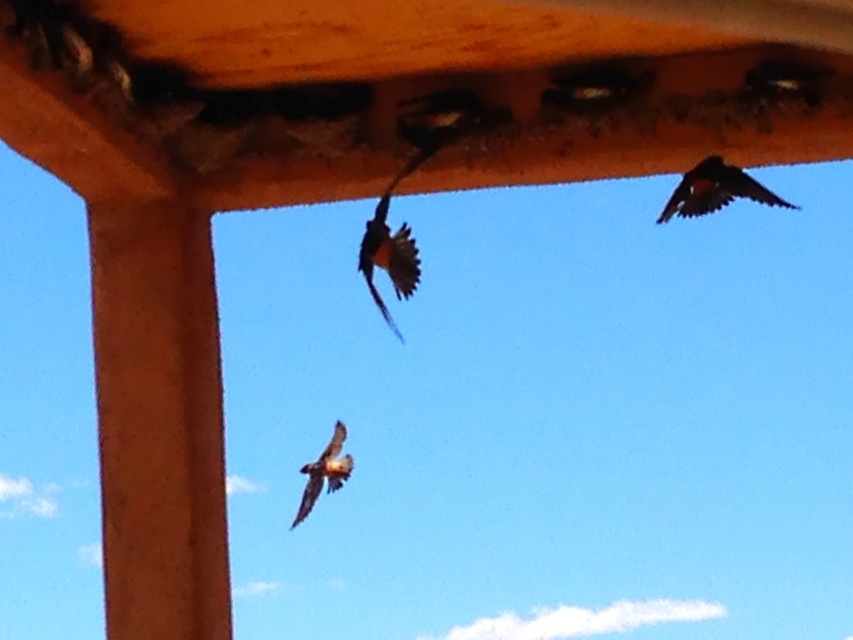
Is orange-brown feathers at center shorter than brown feathered bird at upper right?

No, orange-brown feathers at center is not shorter than brown feathered bird at upper right.

Between orange-brown feathers at center and brown feathered bird at upper right, which one is positioned higher?

brown feathered bird at upper right is above.

Is point (379, 216) closer to camera compared to point (747, 182)?

No, it is not.

Identify the location of orange-brown feathers at center. The height and width of the screenshot is (640, 853). (392, 243).

Does brown feathered bird at upper right have a greater height compared to brown feathered bird at center?

No.

You are a GUI agent. You are given a task and a screenshot of the screen. Output one action in this format:
    pyautogui.click(x=<x>, y=<y>)
    Task: Click on the brown feathered bird at upper right
    
    Given the screenshot: What is the action you would take?
    pyautogui.click(x=715, y=189)

You are a GUI agent. You are given a task and a screenshot of the screen. Output one action in this format:
    pyautogui.click(x=<x>, y=<y>)
    Task: Click on the brown feathered bird at upper right
    This screenshot has height=640, width=853.
    Given the screenshot: What is the action you would take?
    pyautogui.click(x=715, y=189)

Locate an element on the screen. This screenshot has height=640, width=853. brown feathered bird at upper right is located at coordinates (715, 189).

Between orange-brown feathers at center and brown feathered bird at center, which one is positioned higher?

orange-brown feathers at center is above.

Can you confirm if orange-brown feathers at center is positioned to the right of brown feathered bird at center?

Indeed, orange-brown feathers at center is positioned on the right side of brown feathered bird at center.

Who is more distant from viewer, (378, 236) or (320, 486)?

The point (378, 236) is behind.

I want to click on orange-brown feathers at center, so click(x=392, y=243).